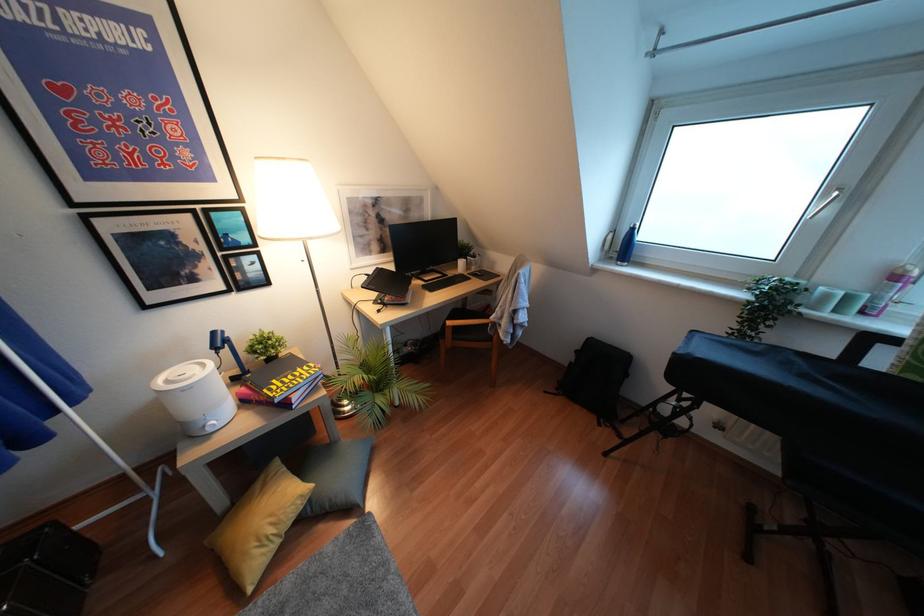
What do you see at coordinates (890, 289) in the screenshot?
I see `a spray bottle nozzle` at bounding box center [890, 289].